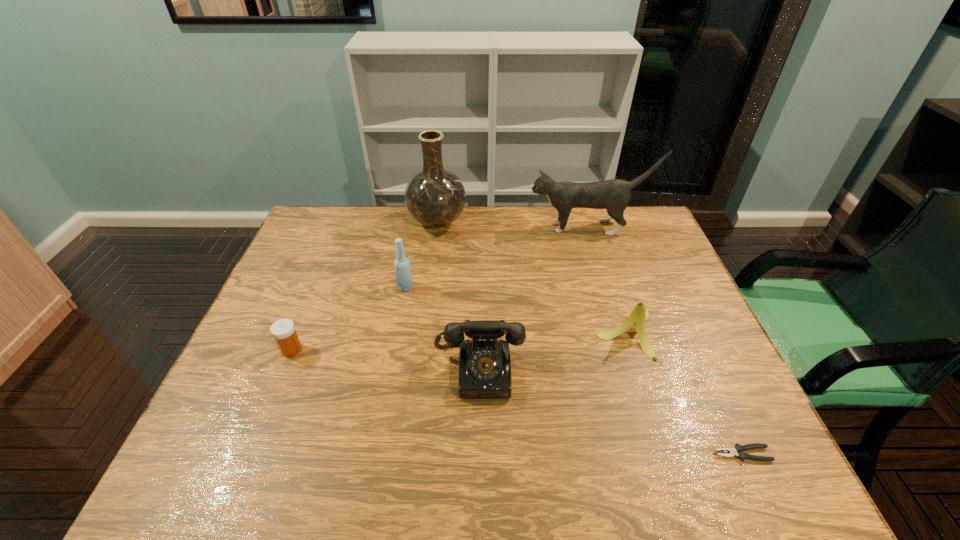
Where is `vacant area at the far edge of the desktop`? The image size is (960, 540). vacant area at the far edge of the desktop is located at coordinates 513,221.

Where is `vacant space at the near edge`? vacant space at the near edge is located at coordinates click(490, 475).

This screenshot has height=540, width=960. I want to click on vacant region at the right edge of the desktop, so click(x=699, y=329).

Identify the location of free space at the far left corner of the desktop. This screenshot has height=540, width=960. (313, 236).

The height and width of the screenshot is (540, 960). I want to click on vacant space at the far right corner, so click(648, 244).

Find the location of a particular element. This screenshot has width=960, height=540. unoccupied position between the vase and the telephone is located at coordinates (458, 296).

The image size is (960, 540). Find the location of `free space between the medicine and the telephone`. free space between the medicine and the telephone is located at coordinates (386, 360).

The height and width of the screenshot is (540, 960). I want to click on free point between the pliers and the medicine, so click(516, 402).

The image size is (960, 540). I want to click on vacant space in between the telephone and the fifth shortest object, so click(443, 328).

In order to click on free point between the cat and the leftmost object in this screenshot , I will do `click(441, 289)`.